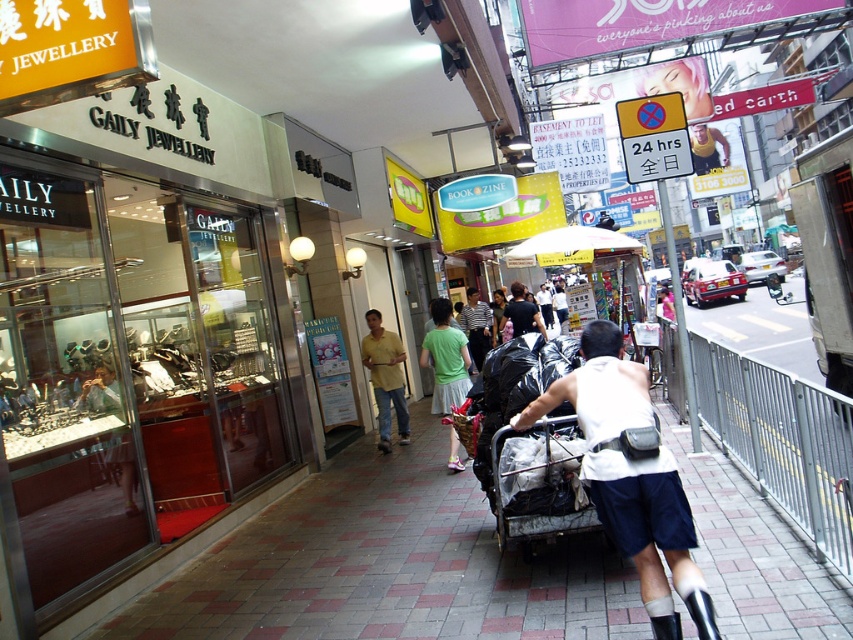
Question: Is white fabric shirt at center closer to camera compared to black plastic cart at center?

Choices:
 (A) yes
 (B) no

Answer: (A)

Question: Which point is closer to the camera taking this photo?

Choices:
 (A) (653, 593)
 (B) (560, 477)
 (C) (488, 330)
 (D) (384, 444)

Answer: (A)

Question: Which object appears farthest from the camera in this image?

Choices:
 (A) striped cotton shirt at center
 (B) polished stone pavement at center
 (C) yellow cotton shirt at center
 (D) green fabric skirt at center

Answer: (A)

Question: Does white fabric shirt at center appear on the left side of black plastic cart at center?

Choices:
 (A) no
 (B) yes

Answer: (A)

Question: Is white fabric shirt at center above black plastic cart at center?

Choices:
 (A) yes
 (B) no

Answer: (A)

Question: Which of the following is the farthest from the observer?

Choices:
 (A) (460, 380)
 (B) (390, 392)
 (C) (486, 339)
 (D) (434, 586)

Answer: (C)